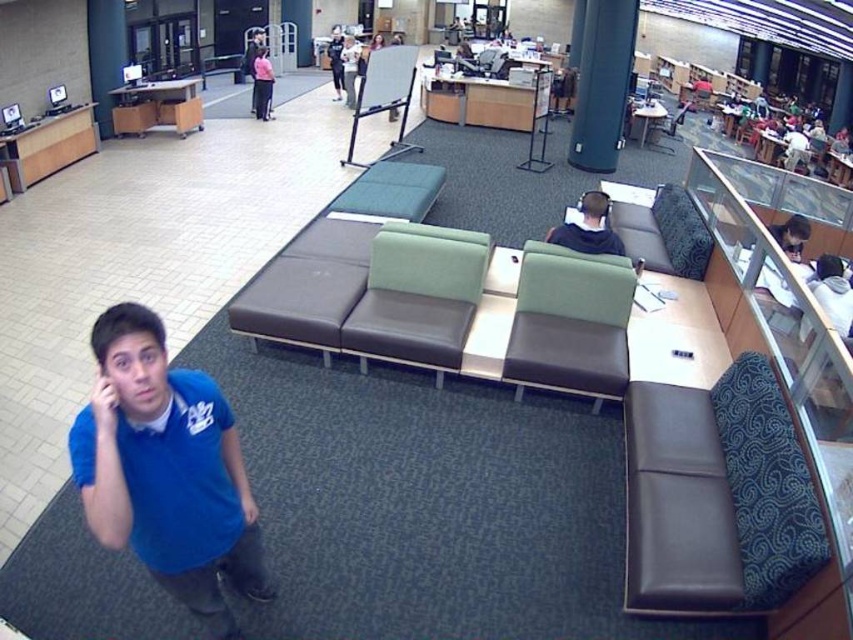
From the picture: You are a security guard in the library and need to determine if the green fabric pillar at upper center can fit through a doorway that is narrower than the white fabric jacket at upper right. Can it fit?

The green fabric pillar at upper center has a width less than the white fabric jacket at upper right. Since the doorway is narrower than the white fabric jacket at upper right, the green fabric pillar at upper center can fit through the doorway as its width is smaller.

You are a security guard in the library and need to locate two items in the image. The dark gray leather headphones at center and the matte black jacket at upper center. Which one is located to the right of the other?

The dark gray leather headphones at center is positioned on the right side of matte black jacket at upper center.

Based on the photo, you are standing at the entrance of the library and want to find a seat. You see the dark brown leather couch at lower right and the green leather couch at center. Which couch is closer to the entrance?

The dark brown leather couch at lower right is closer to the entrance because it is positioned below the green leather couch at center, which places it lower in the image and likely nearer to the entrance from the camera perspective.